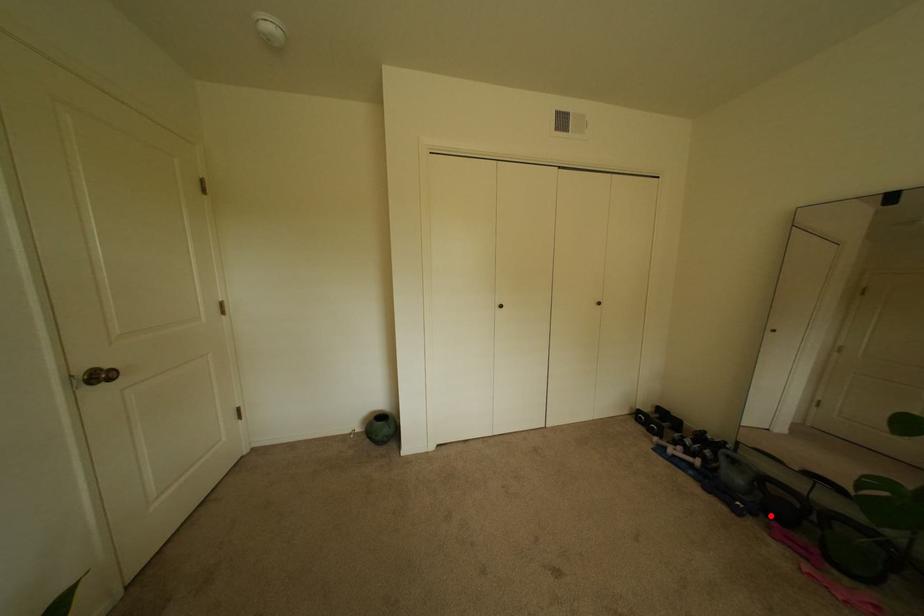
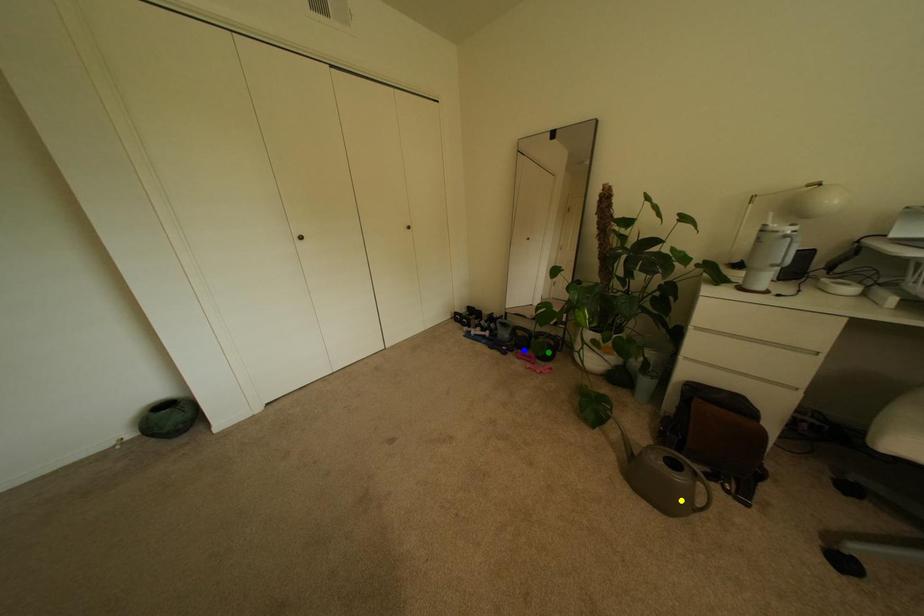
Question: I am providing you with two images of the same scene from different viewpoints. A red point is marked on the first image. You are given multiple points on the second image. In image 2, which mark is for the same physical point as the one in image 1?

Choices:
 (A) green point
 (B) yellow point
 (C) blue point

Answer: (C)